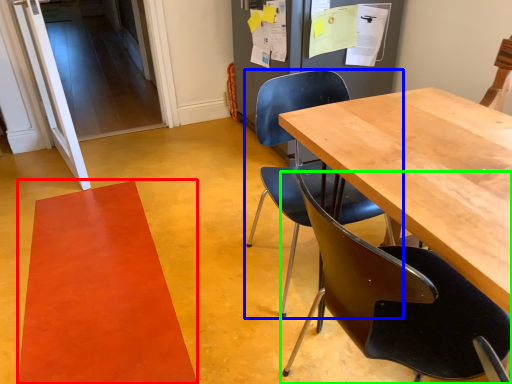
Question: Considering the real-world distances, which object is farthest from mat (highlighted by a red box)? chair (highlighted by a blue box) or chair (highlighted by a green box)?

Choices:
 (A) chair
 (B) chair

Answer: (B)